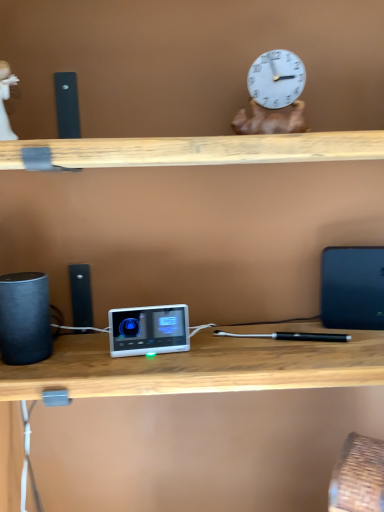
Question: Is white plastic ipod at center oriented away from white porcelain figurine at upper left?

Choices:
 (A) no
 (B) yes

Answer: (A)

Question: Does white plastic ipod at center have a larger size compared to white porcelain figurine at upper left?

Choices:
 (A) no
 (B) yes

Answer: (B)

Question: Would you consider white plastic ipod at center to be distant from white porcelain figurine at upper left?

Choices:
 (A) no
 (B) yes

Answer: (A)

Question: Considering the relative positions of white plastic ipod at center and white porcelain figurine at upper left in the image provided, is white plastic ipod at center behind white porcelain figurine at upper left?

Choices:
 (A) yes
 (B) no

Answer: (A)

Question: From the image's perspective, is white plastic ipod at center below white porcelain figurine at upper left?

Choices:
 (A) yes
 (B) no

Answer: (A)

Question: Can you confirm if white plastic ipod at center is smaller than white porcelain figurine at upper left?

Choices:
 (A) no
 (B) yes

Answer: (A)

Question: Is the position of white plastic ipod at center more distant than that of black matte speaker at left?

Choices:
 (A) yes
 (B) no

Answer: (A)

Question: Does white plastic ipod at center turn towards black matte speaker at left?

Choices:
 (A) no
 (B) yes

Answer: (A)

Question: Can we say white plastic ipod at center lies outside black matte speaker at left?

Choices:
 (A) no
 (B) yes

Answer: (B)

Question: Can you confirm if white plastic ipod at center is taller than black matte speaker at left?

Choices:
 (A) yes
 (B) no

Answer: (B)

Question: From the image's perspective, is white plastic ipod at center located above black matte speaker at left?

Choices:
 (A) yes
 (B) no

Answer: (B)

Question: From the image's perspective, is white plastic ipod at center under black matte speaker at left?

Choices:
 (A) yes
 (B) no

Answer: (A)

Question: Is blue matte laptop at right aimed at white porcelain figurine at upper left?

Choices:
 (A) yes
 (B) no

Answer: (B)